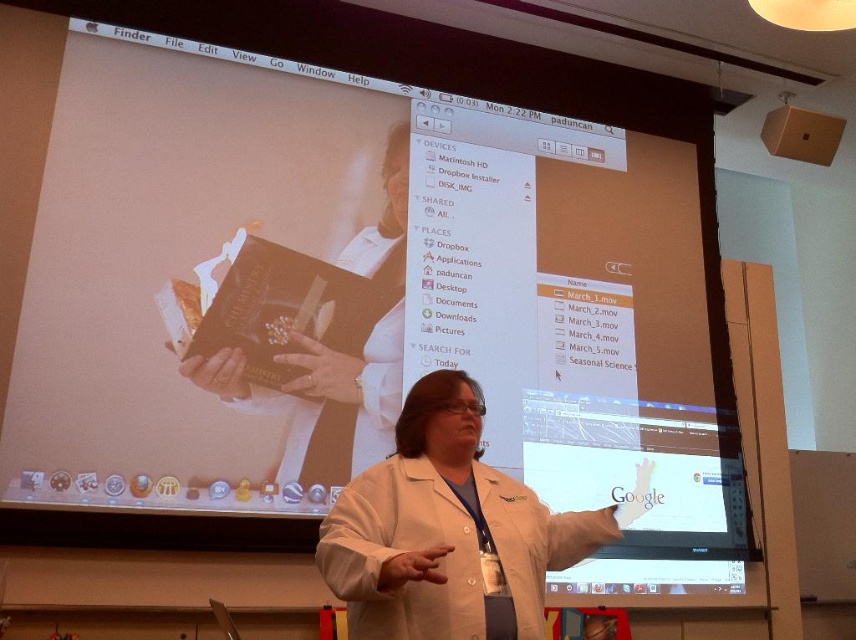
Does point (419, 424) come closer to viewer compared to point (393, 320)?

Yes, it is in front of point (393, 320).

Locate an element on the screen. The height and width of the screenshot is (640, 856). white lab coat at center is located at coordinates (447, 531).